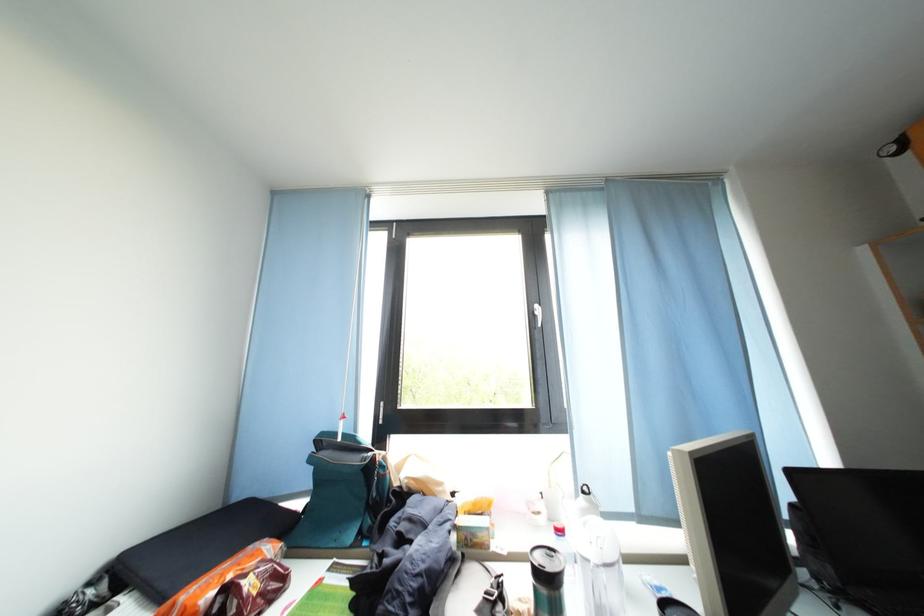
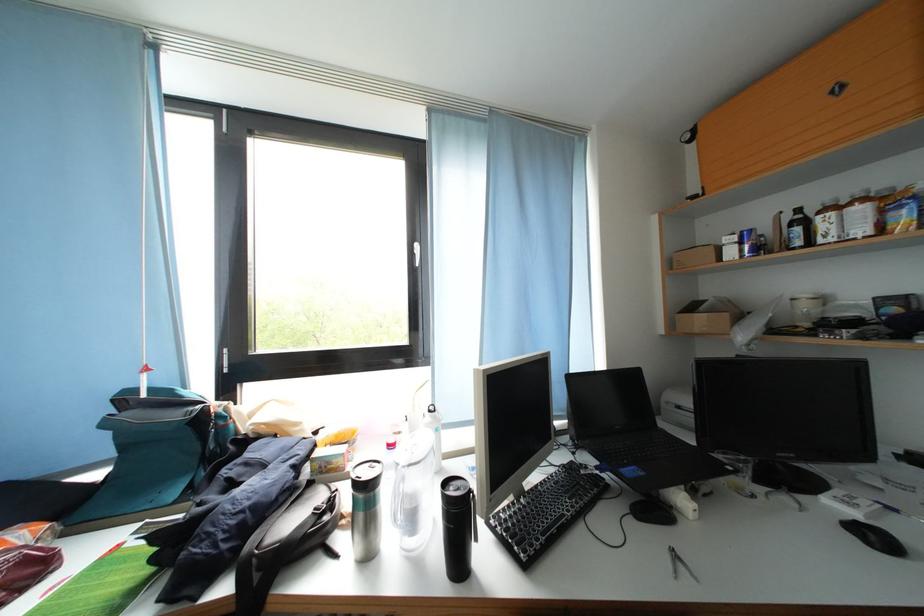
Question: The camera is either moving clockwise (left) or counter-clockwise (right) around the object. The first image is from the beginning of the video and the second image is from the end. Is the camera moving left or right when shooting the video?

Choices:
 (A) Left
 (B) Right

Answer: (A)